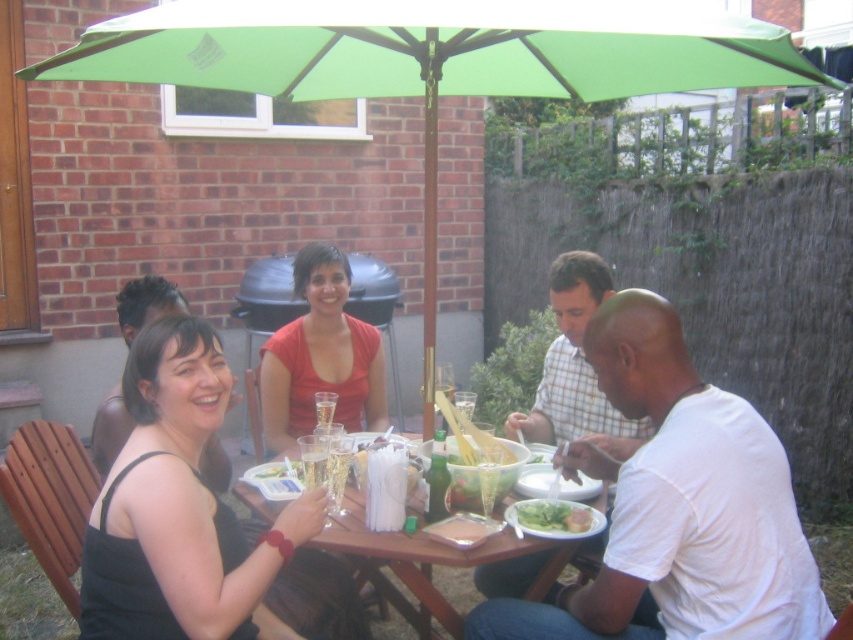
You are planning to set up a new table in the backyard where the green fabric umbrella at center is located. The coordinates of the umbrella are given as point 0.097, 0.510. If you want to place the new table 1 meter to the east of the umbrella, what are the coordinates of the new table?

The coordinates of the new table would be (434, 61) plus 1 meter east. However, without knowing the coordinate system scale, we cannot determine the exact numerical coordinates. The answer requires knowing how the coordinate system maps to real distances like meters.

You are a guest at this outdoor gathering and need to pass a plate from the matte red shirt at center to the white cotton shirt at center. Can you do this without moving more than 3 feet?

The distance between the matte red shirt at center and the white cotton shirt at center is 34.48 inches. Since 34.48 inches is approximately 2.87 feet, which is less than 3 feet, you can pass the plate without moving more than 3 feet.